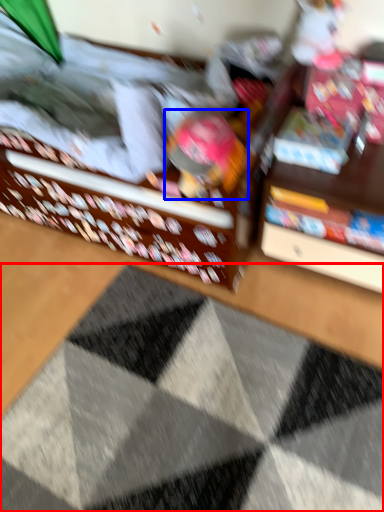
Question: Which object appears farthest to the camera in this image, doormat (highlighted by a red box) or toy (highlighted by a blue box)?

Choices:
 (A) doormat
 (B) toy

Answer: (B)